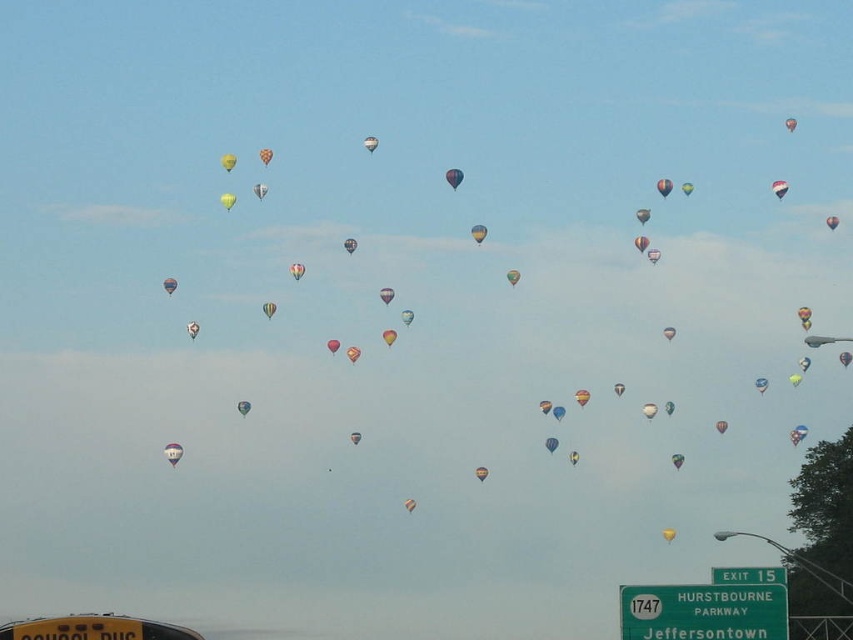
From the picture: Is matte blue balloon at center wider than yellow fabric balloon at upper center?

Incorrect, matte blue balloon at center's width does not surpass yellow fabric balloon at upper center's.

Is point (457, 173) positioned after point (236, 157)?

No, (457, 173) is in front of (236, 157).

Is point (460, 180) behind point (222, 157)?

No, it is not.

Identify the location of matte blue balloon at center. This screenshot has width=853, height=640. (453, 177).